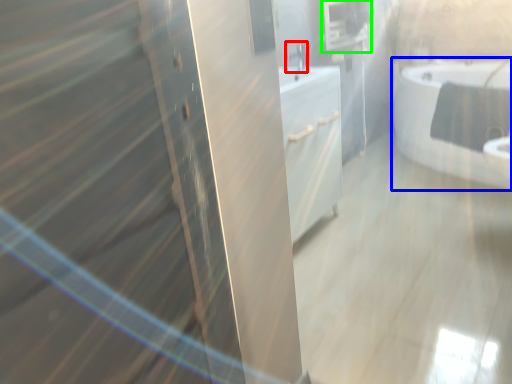
Question: Estimate the real-world distances between objects in this image. Which object is closer to faucet (highlighted by a red box), bathtub (highlighted by a blue box) or medicine cabinet (highlighted by a green box)?

Choices:
 (A) bathtub
 (B) medicine cabinet

Answer: (B)